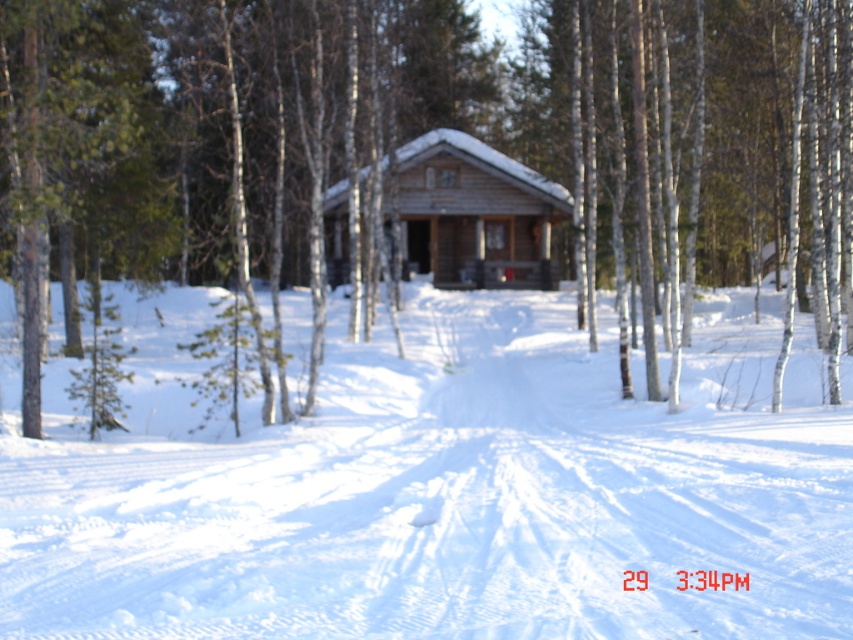
Is white powdery snow at center bigger than wooden cabin at center?

Yes, white powdery snow at center is bigger than wooden cabin at center.

Who is lower down, white powdery snow at center or wooden cabin at center?

white powdery snow at center

Which is in front, point (421, 632) or point (514, 180)?

Positioned in front is point (421, 632).

You are a GUI agent. You are given a task and a screenshot of the screen. Output one action in this format:
    pyautogui.click(x=<x>, y=<y>)
    Task: Click on the white powdery snow at center
    This screenshot has height=640, width=853.
    Given the screenshot: What is the action you would take?
    pyautogui.click(x=439, y=486)

Who is more forward, (663, 310) or (343, 256)?

Point (663, 310) is in front.

Does brown wood log cabin at center appear on the right side of wooden cabin at center?

Correct, you'll find brown wood log cabin at center to the right of wooden cabin at center.

Does point (552, 230) lie in front of point (476, 204)?

No.

This screenshot has height=640, width=853. Identify the location of brown wood log cabin at center. pos(431,163).

Find the location of a particular element. The image size is (853, 640). brown wood log cabin at center is located at coordinates (431, 163).

Does brown wood log cabin at center appear over white powdery snow at center?

Yes.

Does point (340, 84) lie in front of point (518, 353)?

That is True.

At what (x,y) coordinates should I click in order to perform the action: click on brown wood log cabin at center. Please return your answer as a coordinate pair (x, y). Looking at the image, I should click on (431, 163).